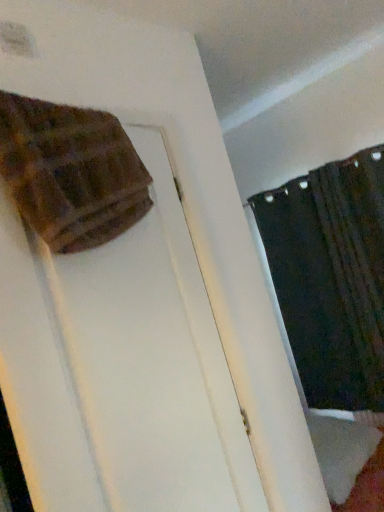
Question: Relative to brown textured blanket at upper left, is black textured curtain at upper right in front or behind?

Choices:
 (A) front
 (B) behind

Answer: (B)

Question: Considering the positions of black textured curtain at upper right and brown textured blanket at upper left in the image, is black textured curtain at upper right taller or shorter than brown textured blanket at upper left?

Choices:
 (A) tall
 (B) short

Answer: (A)

Question: Is point [x=339, y=375] closer or farther from the camera than point [x=28, y=188]?

Choices:
 (A) farther
 (B) closer

Answer: (A)

Question: Is brown textured blanket at upper left wider or thinner than black textured curtain at upper right?

Choices:
 (A) wide
 (B) thin

Answer: (A)

Question: From the image's perspective, is brown textured blanket at upper left positioned above or below black textured curtain at upper right?

Choices:
 (A) below
 (B) above

Answer: (B)

Question: In terms of size, does brown textured blanket at upper left appear bigger or smaller than black textured curtain at upper right?

Choices:
 (A) big
 (B) small

Answer: (B)

Question: Is brown textured blanket at upper left taller or shorter than black textured curtain at upper right?

Choices:
 (A) tall
 (B) short

Answer: (B)